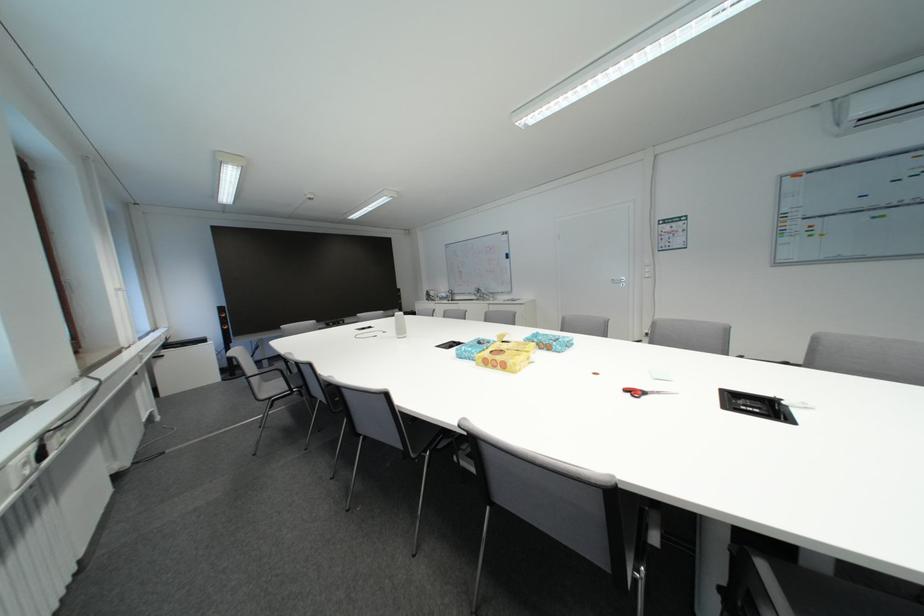
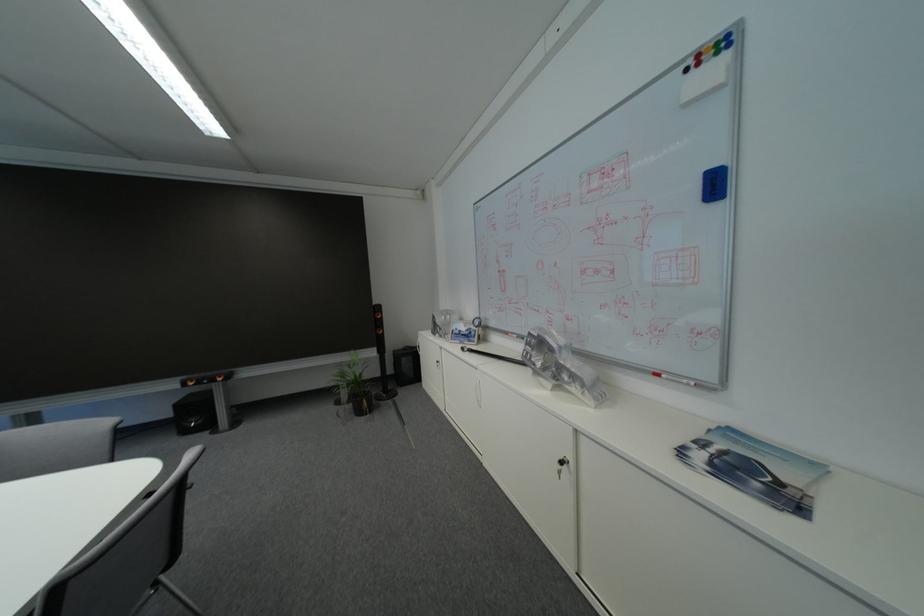
Where in the second image is the point corresponding to point 515,233 from the first image?

(723, 34)